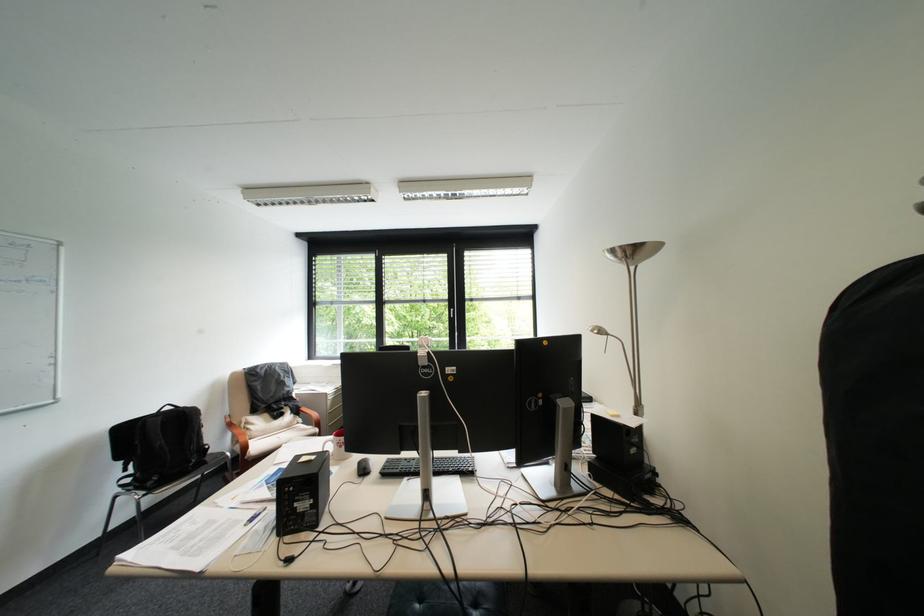
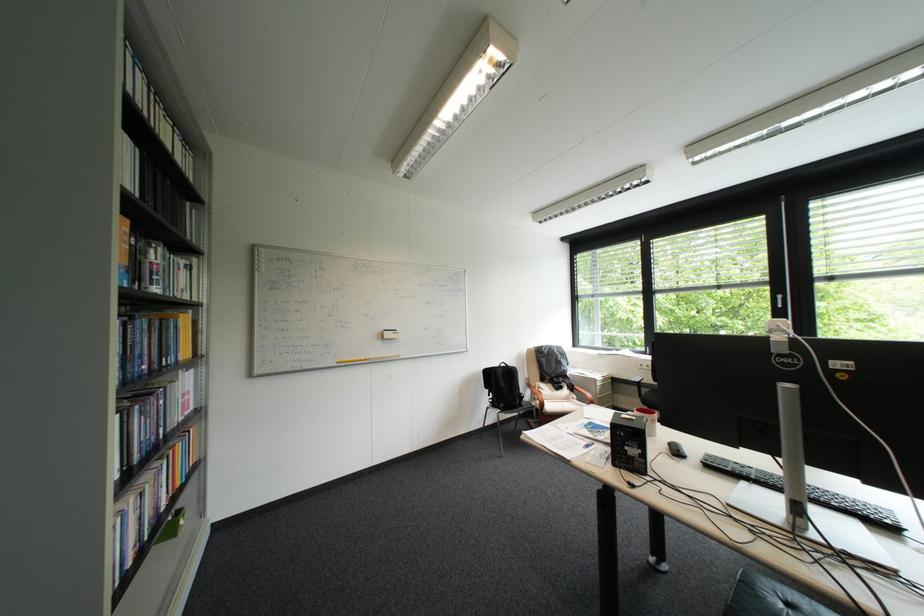
Find the pixel in the second image that matches pixel 129 459 in the first image.

(497, 387)